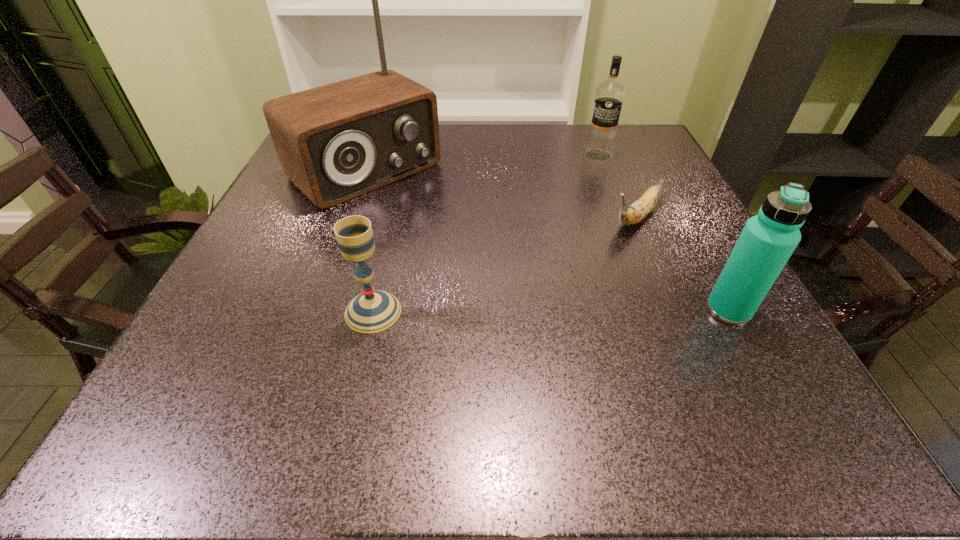
The height and width of the screenshot is (540, 960). Find the location of `vacant space situated 0.360m on the front-facing side of the tallest object`. vacant space situated 0.360m on the front-facing side of the tallest object is located at coordinates (518, 291).

You are a GUI agent. You are given a task and a screenshot of the screen. Output one action in this format:
    pyautogui.click(x=<x>, y=<y>)
    Task: Click on the free spot located 0.100m on the front-facing side of the tallest object
    Image resolution: width=960 pixels, height=540 pixels.
    Given the screenshot: What is the action you would take?
    pyautogui.click(x=433, y=223)

This screenshot has height=540, width=960. I want to click on blank area located 0.120m on the front-facing side of the tallest object, so click(x=439, y=227).

Locate an element on the screen. Image resolution: width=960 pixels, height=540 pixels. free spot located on the peel of the shortest object is located at coordinates (580, 265).

This screenshot has height=540, width=960. Find the location of `vacant space positioned 0.200m on the peel of the shortest object`. vacant space positioned 0.200m on the peel of the shortest object is located at coordinates (562, 281).

Identify the location of free space located 0.200m on the peel of the shortest object. This screenshot has width=960, height=540. (562, 281).

At what (x,y) coordinates should I click in order to perform the action: click on vodka present at the far edge. Please return your answer as a coordinate pair (x, y). The width and height of the screenshot is (960, 540). Looking at the image, I should click on (609, 95).

The height and width of the screenshot is (540, 960). What are the coordinates of `radio receiver situated at the far edge` in the screenshot? It's located at (335, 142).

Identify the location of object located at the near edge. This screenshot has height=540, width=960. (372, 311).

The width and height of the screenshot is (960, 540). I want to click on object that is at the left edge, so tap(335, 142).